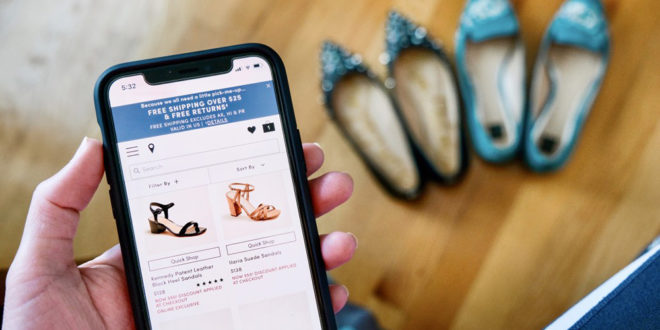
The height and width of the screenshot is (330, 660). I want to click on brown hardwood floor, so click(x=467, y=249), click(x=308, y=25).